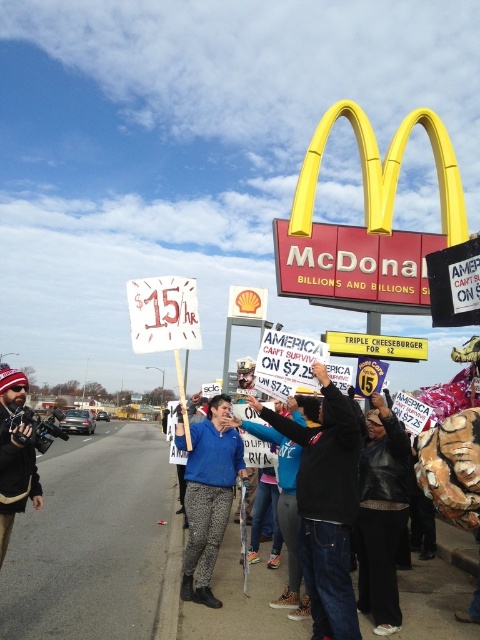
Question: Which point is closer to the camera?

Choices:
 (A) blue denim jeans at center
 (B) knitted wool hat at left
 (C) blue fabric jacket at center

Answer: (B)

Question: Estimate the real-world distances between objects in this image. Which object is farther from the blue denim jeans at center?

Choices:
 (A) black leather jacket at center
 (B) knitted wool hat at left

Answer: (B)

Question: Which object is the closest to the black leather jacket at center?

Choices:
 (A) knitted wool hat at left
 (B) blue denim jeans at center

Answer: (B)

Question: Is blue denim jeans at center positioned at the back of knitted wool hat at left?

Choices:
 (A) no
 (B) yes

Answer: (B)

Question: Does blue denim jeans at center have a smaller size compared to black leather jacket at center?

Choices:
 (A) no
 (B) yes

Answer: (B)

Question: Observing the image, what is the correct spatial positioning of blue denim jeans at center in reference to black leather jacket at center?

Choices:
 (A) left
 (B) right

Answer: (A)